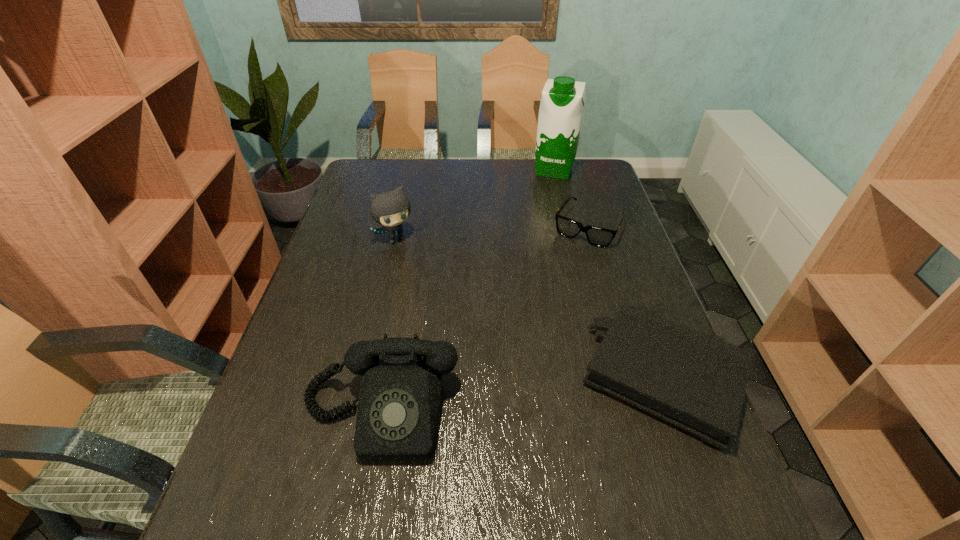
Image resolution: width=960 pixels, height=540 pixels. What are the coordinates of `telephone` in the screenshot? It's located at (400, 397).

The width and height of the screenshot is (960, 540). Find the location of `Bible`. Bible is located at coordinates (697, 382).

Find the location of a particular element. This screenshot has width=960, height=540. sunglasses is located at coordinates (597, 236).

Identify the location of the tallest object. Image resolution: width=960 pixels, height=540 pixels. (562, 102).

Find the location of `the farthest object`. the farthest object is located at coordinates (562, 102).

Locate an element on the screen. kitten is located at coordinates (391, 208).

Image resolution: width=960 pixels, height=540 pixels. I want to click on vacant space located on the left of the second shortest object, so click(x=424, y=377).

Find the location of a particular element. This screenshot has width=960, height=540. free spot located on the front-facing side of the sunglasses is located at coordinates (571, 256).

Where is `free point located 0.350m on the front-facing side of the sunglasses`? Image resolution: width=960 pixels, height=540 pixels. free point located 0.350m on the front-facing side of the sunglasses is located at coordinates (530, 325).

You are a GUI agent. You are given a task and a screenshot of the screen. Output one action in this format:
    pyautogui.click(x=<x>, y=<y>)
    Task: Click on the vacant space located 0.210m on the front-facing side of the sunglasses
    
    Given the screenshot: What is the action you would take?
    (551, 290)